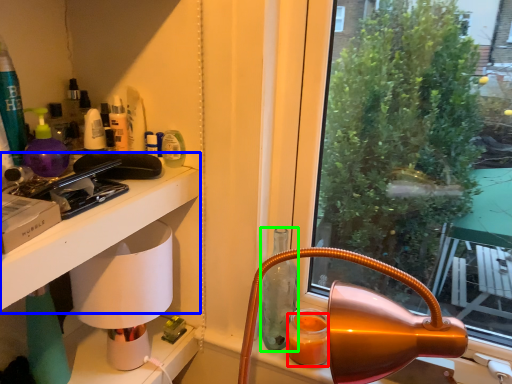
Question: Considering the real-world distances, which object is closest to orange juice (highlighted by a red box)? table (highlighted by a blue box) or bottle (highlighted by a green box).

Choices:
 (A) table
 (B) bottle

Answer: (B)